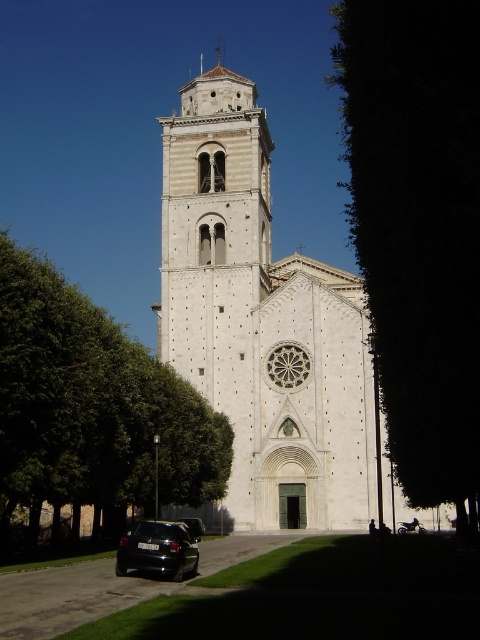
Question: Considering the relative positions of white stone church at center and black matte car at lower left in the image provided, where is white stone church at center located with respect to black matte car at lower left?

Choices:
 (A) below
 (B) above

Answer: (B)

Question: Which object is farther from the camera taking this photo?

Choices:
 (A) green leafy tree at left
 (B) white stone church at center
 (C) green leafy tree at right

Answer: (B)

Question: Which object appears farthest from the camera in this image?

Choices:
 (A) green leafy tree at left
 (B) white stone church at center

Answer: (B)

Question: Which is farther from the black matte car at lower left?

Choices:
 (A) green leafy tree at left
 (B) green leafy tree at right
 (C) black glossy car at lower left

Answer: (B)

Question: Can you confirm if white stone church at center is positioned below green leafy tree at right?

Choices:
 (A) yes
 (B) no

Answer: (B)

Question: Does green leafy tree at right appear on the right side of black matte car at lower left?

Choices:
 (A) yes
 (B) no

Answer: (A)